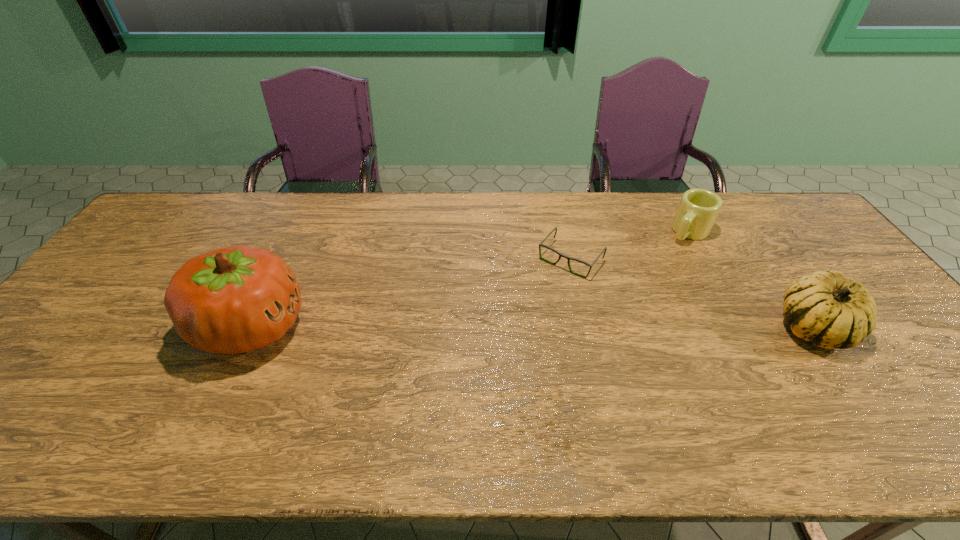
Locate an element on the screen. The height and width of the screenshot is (540, 960). the leftmost object is located at coordinates (236, 299).

Where is `pumpkin`? The image size is (960, 540). pumpkin is located at coordinates (236, 299).

I want to click on the rightmost object, so click(831, 311).

What are the coordinates of `gourd` in the screenshot? It's located at (831, 311).

Where is `the second object from right to left`? This screenshot has height=540, width=960. the second object from right to left is located at coordinates (698, 209).

Image resolution: width=960 pixels, height=540 pixels. I want to click on the second shortest object, so click(698, 209).

This screenshot has width=960, height=540. In order to click on the third object from right to left in this screenshot , I will do `click(560, 254)`.

You are a GUI agent. You are given a task and a screenshot of the screen. Output one action in this format:
    pyautogui.click(x=<x>, y=<y>)
    Task: Click on the shortest object
    The image size is (960, 540).
    Given the screenshot: What is the action you would take?
    click(560, 254)

At what (x,y) coordinates should I click in order to perform the action: click on free space located 0.360m on the side of the pumpkin with the cute face. Please return your answer as a coordinate pair (x, y). Looking at the image, I should click on (444, 327).

You are a GUI agent. You are given a task and a screenshot of the screen. Output one action in this format:
    pyautogui.click(x=<x>, y=<y>)
    Task: Click on the vacant area situated on the back of the third shortest object
    
    Given the screenshot: What is the action you would take?
    pyautogui.click(x=745, y=230)